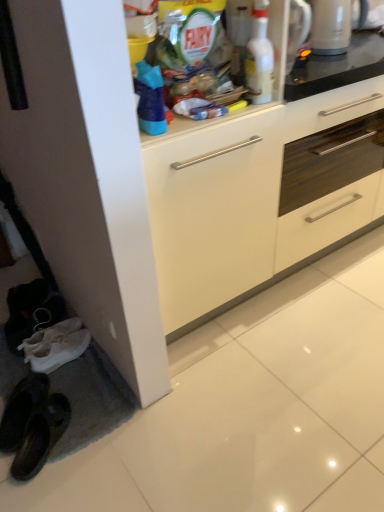
Question: From a real-world perspective, is white glossy cabinet at center located beneath white glossy kettle at upper right?

Choices:
 (A) yes
 (B) no

Answer: (A)

Question: Is white glossy cabinet at center outside white glossy kettle at upper right?

Choices:
 (A) yes
 (B) no

Answer: (A)

Question: Is white glossy cabinet at center positioned with its back to white glossy kettle at upper right?

Choices:
 (A) no
 (B) yes

Answer: (A)

Question: From the image's perspective, is white glossy cabinet at center beneath white glossy kettle at upper right?

Choices:
 (A) no
 (B) yes

Answer: (B)

Question: Considering the relative sizes of white glossy cabinet at center and white glossy kettle at upper right in the image provided, is white glossy cabinet at center thinner than white glossy kettle at upper right?

Choices:
 (A) no
 (B) yes

Answer: (A)

Question: Can you confirm if white glossy cabinet at center is taller than white glossy kettle at upper right?

Choices:
 (A) yes
 (B) no

Answer: (A)

Question: From a real-world perspective, is white glossy kettle at upper right under white glossy bottle at upper center?

Choices:
 (A) no
 (B) yes

Answer: (B)

Question: Does white glossy kettle at upper right lie behind white glossy bottle at upper center?

Choices:
 (A) yes
 (B) no

Answer: (A)

Question: Does white glossy kettle at upper right touch white glossy bottle at upper center?

Choices:
 (A) yes
 (B) no

Answer: (B)

Question: Is white glossy kettle at upper right at the right side of white glossy bottle at upper center?

Choices:
 (A) no
 (B) yes

Answer: (B)

Question: From the image's perspective, is white glossy kettle at upper right under white glossy bottle at upper center?

Choices:
 (A) no
 (B) yes

Answer: (A)

Question: Is white glossy kettle at upper right facing away from white glossy bottle at upper center?

Choices:
 (A) no
 (B) yes

Answer: (A)

Question: From a real-world perspective, does white glossy bottle at upper center sit lower than white glossy kettle at upper right?

Choices:
 (A) no
 (B) yes

Answer: (A)